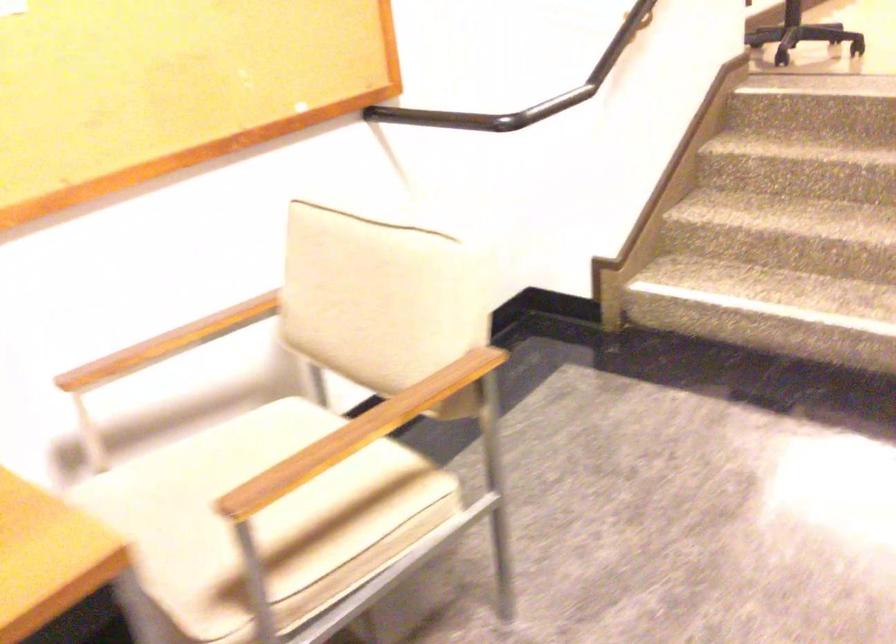
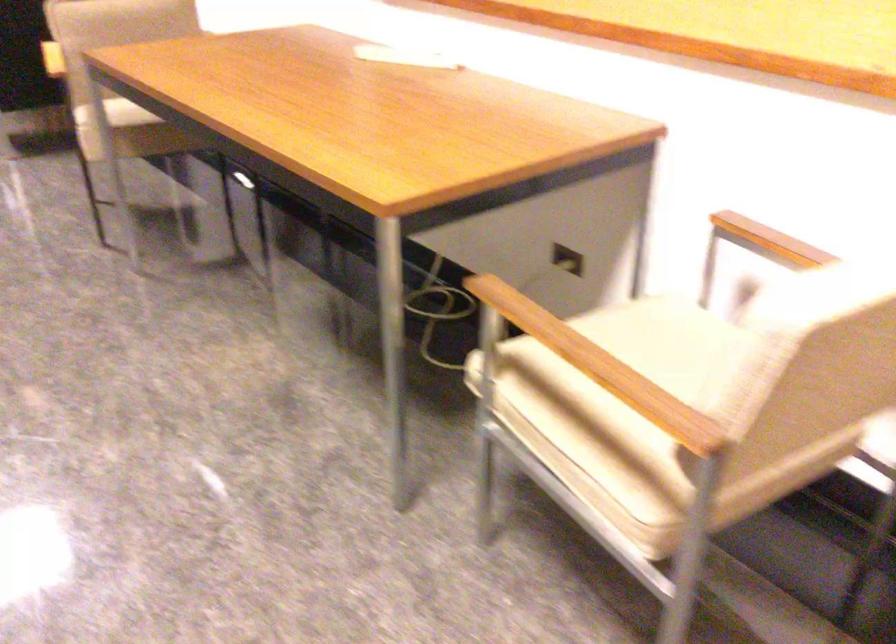
Find the pixel in the second image that matches point (451, 397) in the first image.

(619, 399)